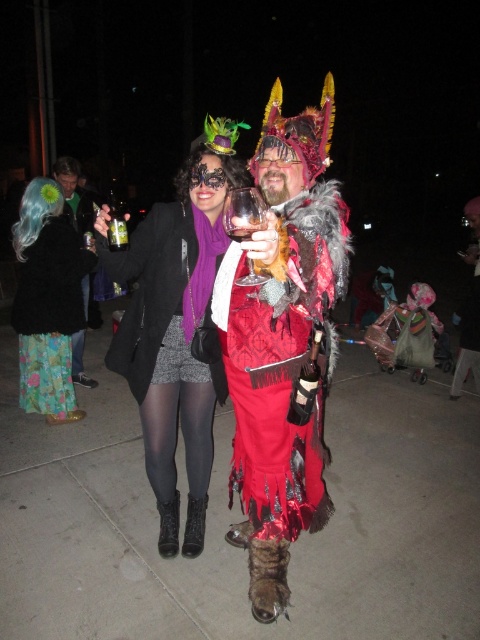
You are a photographer at the event and want to capture both the floral fabric skirt at lower left and the clear plastic cup at upper left in the same frame. Which object should you focus on first to ensure both are in the shot?

The floral fabric skirt at lower left is smaller than the clear plastic cup at upper left, so you should focus on the clear plastic cup at upper left first to ensure both fit in the frame.

You are at a party and want to grab your drink without moving your hand too much. The floral fabric dress at left is in your way. Is the clear plastic cup at upper left reachable without moving the dress?

The clear plastic cup at upper left is behind the floral fabric dress at left, so you would need to move the dress to reach it.

You are a photographer trying to capture a clear shot of the floral fabric skirt at lower left. Considering the distance, can you estimate how far you need to move forward to get the skirt into focus if your camera has a minimum focusing distance of 2 meters?

The floral fabric skirt at lower left is 3.33 meters away from the camera. Since your camera has a minimum focusing distance of 2 meters, you need to move forward by 1.33 meters to get the skirt into focus.